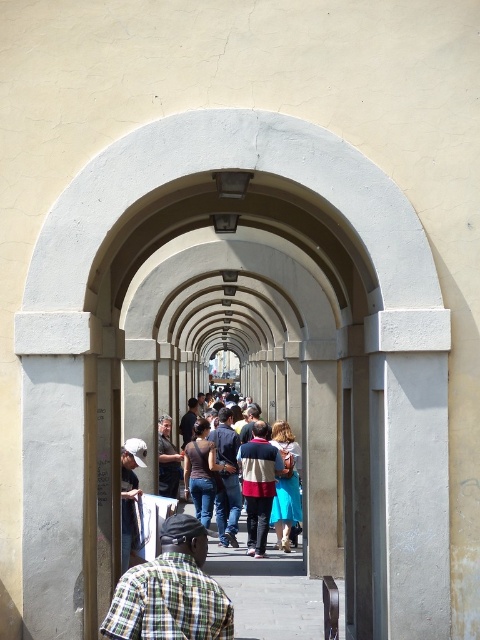
You are standing at the entrance of the arched passageway and notice two people wearing a green plaid shirt at center and a matte brown shirt at center. Which person is closer to the entrance?

The green plaid shirt at center is shorter than the matte brown shirt at center, so the person wearing the green plaid shirt at center is closer to the entrance.